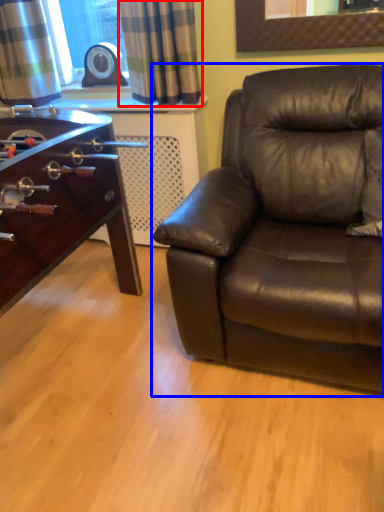
Question: Which point is further to the camera, curtain (highlighted by a red box) or studio couch (highlighted by a blue box)?

Choices:
 (A) curtain
 (B) studio couch

Answer: (A)